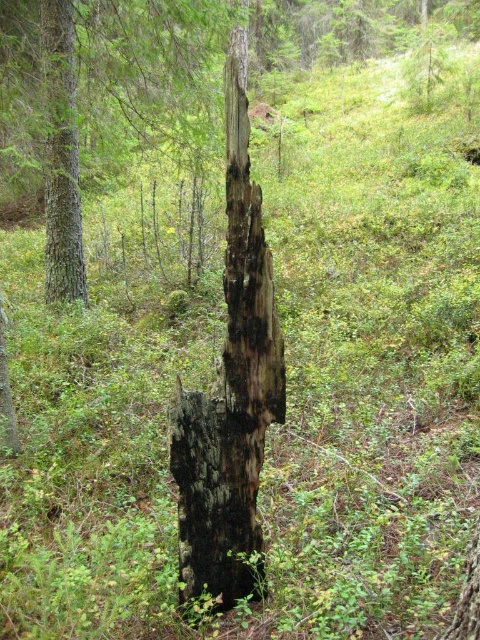
You are a park ranger assessing the forest area. You need to determine which object has a smaller diameter. Which one is thinner between the charcoal wood stump at center and the smooth brown tree trunk at left?

The charcoal wood stump at center is thinner than the smooth brown tree trunk at left according to the description.